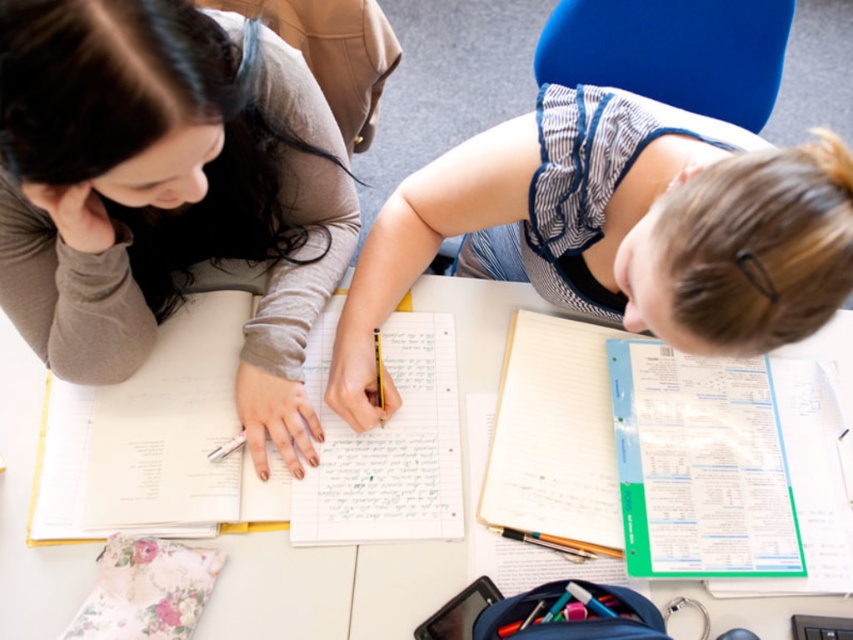
Question: Considering the real-world distances, which object is farthest from the matte gray sweater at upper left?

Choices:
 (A) white paper notebook at lower right
 (B) white paper at center
 (C) white paper notebook at center

Answer: (A)

Question: Can you confirm if matte gray sweater at upper left is bigger than white paper notebook at lower right?

Choices:
 (A) no
 (B) yes

Answer: (B)

Question: Which of these objects is positioned closest to the matte gray sweater at upper left?

Choices:
 (A) white lined paper at center
 (B) white paper notebook at center
 (C) white paper at center

Answer: (A)

Question: Can you confirm if matte gray sweater at upper left is positioned above white paper notebook at lower right?

Choices:
 (A) no
 (B) yes

Answer: (B)

Question: In this image, where is white paper notebook at lower right located relative to white lined paper at center?

Choices:
 (A) above
 (B) below

Answer: (B)

Question: Which object appears farthest from the camera in this image?

Choices:
 (A) matte gray sweater at upper left
 (B) white paper notebook at lower right

Answer: (B)